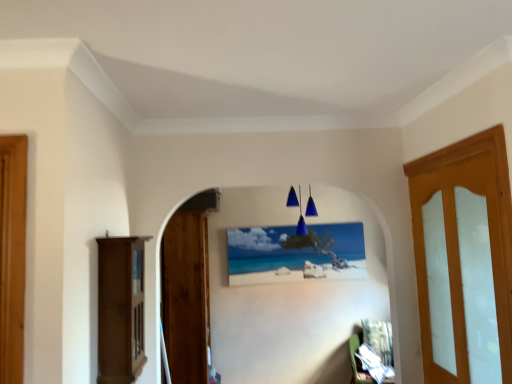
Locate an element on the screen. The width and height of the screenshot is (512, 384). free location above light brown wooden door at right, arranged as the 2th door when viewed from the left (from a real-world perspective) is located at coordinates (445, 160).